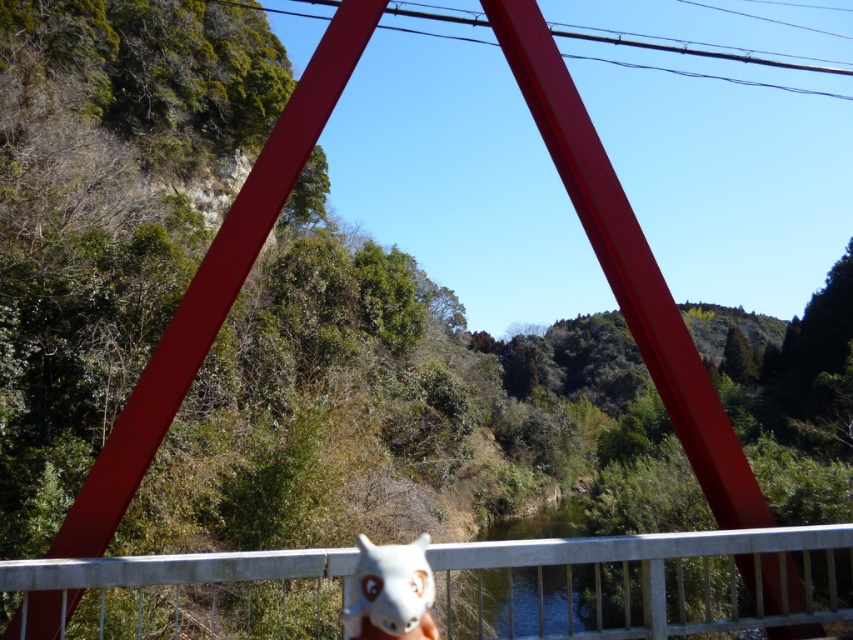
Question: Estimate the real-world distances between objects in this image. Which object is closer to the white matte animal at center?

Choices:
 (A) green smooth water at center
 (B) white metal rail at bottom

Answer: (B)

Question: Which point appears farthest from the camera in this image?

Choices:
 (A) (672, 616)
 (B) (492, 552)

Answer: (A)

Question: Does white metal rail at bottom have a smaller size compared to white matte animal at center?

Choices:
 (A) yes
 (B) no

Answer: (B)

Question: Is green smooth water at center wider than white matte animal at center?

Choices:
 (A) no
 (B) yes

Answer: (B)

Question: Which object appears closest to the camera in this image?

Choices:
 (A) white metal rail at bottom
 (B) green smooth water at center
 (C) white matte animal at center

Answer: (C)

Question: Does white metal rail at bottom come behind green smooth water at center?

Choices:
 (A) yes
 (B) no

Answer: (B)